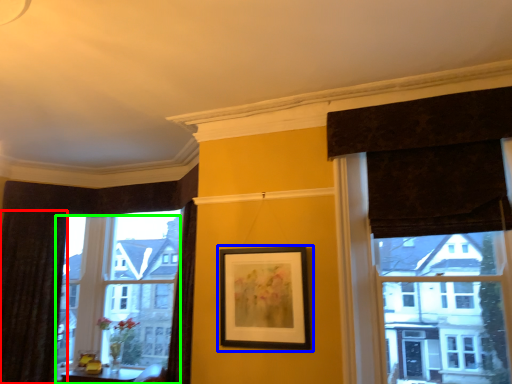
Question: Based on their relative distances, which object is farther from curtain (highlighted by a red box)? Choose from picture frame (highlighted by a blue box) and window (highlighted by a green box).

Choices:
 (A) picture frame
 (B) window

Answer: (A)